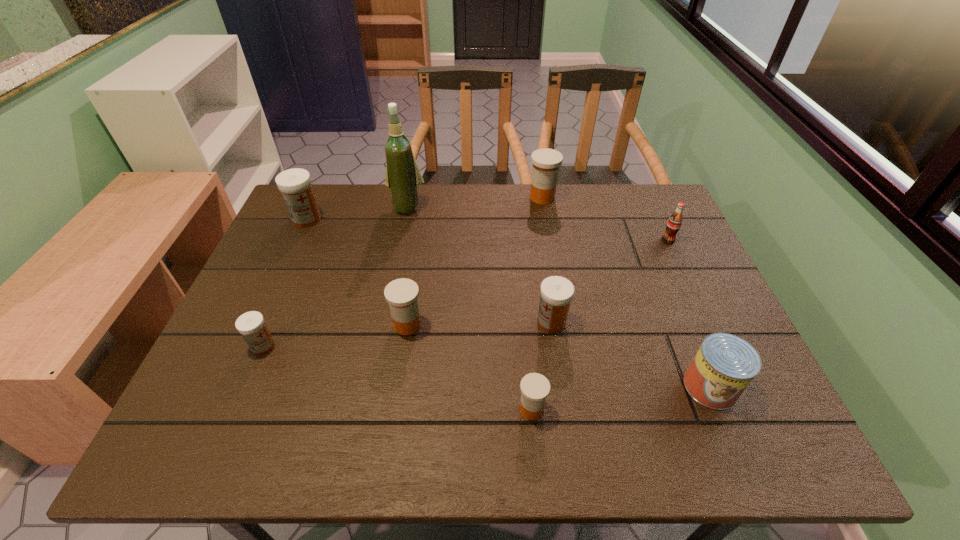
This screenshot has height=540, width=960. Find the location of `the tallest object`. the tallest object is located at coordinates (403, 177).

This screenshot has height=540, width=960. Identify the location of the farthest medicine. (546, 162).

At what (x,y) coordinates should I click in order to perform the action: click on the farthest orange medicine. Please return your answer as a coordinate pair (x, y). The width and height of the screenshot is (960, 540). Looking at the image, I should click on (546, 162).

The height and width of the screenshot is (540, 960). I want to click on the biggest white medicine, so click(x=294, y=184).

The height and width of the screenshot is (540, 960). What are the coordinates of `the fifth nearest medicine` in the screenshot? It's located at (294, 184).

Find the location of a particular element. This screenshot has height=540, width=960. the sixth nearest object is located at coordinates pos(674,223).

At what (x,y) coordinates should I click in order to perform the action: click on the fourth medicine from right to left. Please return your answer as a coordinate pair (x, y). The width and height of the screenshot is (960, 540). Looking at the image, I should click on (401, 294).

Locate an element on the screen. The image size is (960, 540). the leftmost orange medicine is located at coordinates (401, 294).

You are a GUI agent. You are given a task and a screenshot of the screen. Output one action in this format:
    pyautogui.click(x=<x>, y=<y>)
    Task: Click on the rightmost white medicine
    The image size is (960, 540).
    Given the screenshot: What is the action you would take?
    pyautogui.click(x=556, y=292)

Locate an element on the screen. the second smallest white medicine is located at coordinates (556, 292).